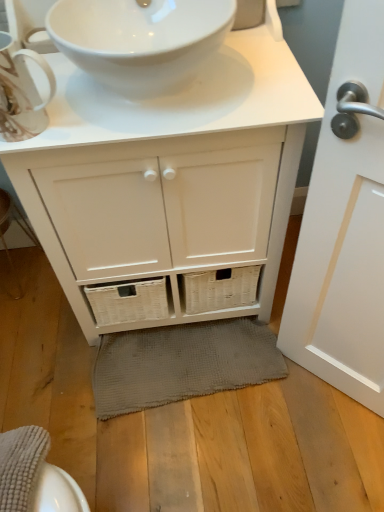
Describe the element at coordinates (169, 185) in the screenshot. I see `white matte cabinet at center` at that location.

What is the approximate width of white glossy door handle at right?

The width of white glossy door handle at right is 3.23 inches.

The image size is (384, 512). I want to click on white glossy sink at upper center, so click(140, 39).

This screenshot has width=384, height=512. I want to click on white matte cabinet at center, so click(x=169, y=185).

In the scene shown: Is white glossy sink at upper center bigger or smaller than matte white teacup at upper left?

Considering their sizes, white glossy sink at upper center takes up more space than matte white teacup at upper left.

Between white glossy sink at upper center and matte white teacup at upper left, which one has larger width?

Wider between the two is white glossy sink at upper center.

How different are the orientations of white glossy sink at upper center and matte white teacup at upper left in degrees?

The angular difference between white glossy sink at upper center and matte white teacup at upper left is 0.000955 degrees.

From the image's perspective, which one is positioned lower, white glossy sink at upper center or matte white teacup at upper left?

matte white teacup at upper left is shown below in the image.

In the scene shown: From a real-world perspective, between white glossy door handle at right and white glossy sink at upper center, who is vertically lower?

white glossy door handle at right.

From the image's perspective, is white glossy door handle at right above white glossy sink at upper center?

No.

Does white glossy door handle at right turn towards white glossy sink at upper center?

No, white glossy door handle at right is not turned towards white glossy sink at upper center.

From the image's perspective, does matte white teacup at upper left appear lower than white glossy door handle at right?

Actually, matte white teacup at upper left appears above white glossy door handle at right in the image.

In terms of width, does matte white teacup at upper left look wider or thinner when compared to white glossy door handle at right?

matte white teacup at upper left is wider than white glossy door handle at right.

Is point (4, 57) positioned behind point (373, 225)?

No, it is not.

Which object is positioned more to the right, matte white teacup at upper left or white glossy door handle at right?

white glossy door handle at right is more to the right.

Is white matte cabinet at center turned away from gray textured bath mat at lower center?

white matte cabinet at center is not turned away from gray textured bath mat at lower center.

From the image's perspective, which one is positioned lower, white matte cabinet at center or gray textured bath mat at lower center?

gray textured bath mat at lower center, from the image's perspective.

From a real-world perspective, is white matte cabinet at center positioned under gray textured bath mat at lower center based on gravity?

No, from a real-world perspective, white matte cabinet at center is not beneath gray textured bath mat at lower center.

Considering the positions of objects gray textured bath mat at lower center and matte white teacup at upper left in the image provided, who is more to the left, gray textured bath mat at lower center or matte white teacup at upper left?

matte white teacup at upper left is more to the left.

Is gray textured bath mat at lower center in front of or behind matte white teacup at upper left in the image?

Clearly, gray textured bath mat at lower center is behind matte white teacup at upper left.

Is gray textured bath mat at lower center placed right next to matte white teacup at upper left?

No, gray textured bath mat at lower center is not beside matte white teacup at upper left.

Is white glossy sink at upper center behind white glossy door handle at right?

Yes, it is.

From a real-world perspective, between white glossy sink at upper center and white glossy door handle at right, who is vertically higher?

white glossy sink at upper center, from a real-world perspective.

Can you confirm if white glossy sink at upper center is wider than white glossy door handle at right?

Indeed, white glossy sink at upper center has a greater width compared to white glossy door handle at right.

Based on their sizes in the image, would you say gray textured bath mat at lower center is bigger or smaller than white matte cabinet at center?

In the image, gray textured bath mat at lower center appears to be smaller than white matte cabinet at center.

From the image's perspective, is gray textured bath mat at lower center located above or below white matte cabinet at center?

Based on their image positions, gray textured bath mat at lower center is located beneath white matte cabinet at center.

Is gray textured bath mat at lower center not near white matte cabinet at center?

They are positioned close to each other.

Is gray textured bath mat at lower center in front of or behind white matte cabinet at center in the image?

gray textured bath mat at lower center is positioned farther from the viewer than white matte cabinet at center.

Locate an element on the screen. sink to the right of matte white teacup at upper left is located at coordinates (140, 39).

Locate an element on the screen. The width and height of the screenshot is (384, 512). sink above the white glossy door handle at right (from a real-world perspective) is located at coordinates (140, 39).

When comparing their distances from gray textured bath mat at lower center, does white glossy door handle at right or white matte cabinet at center seem further?

Among the two, white glossy door handle at right is located further to gray textured bath mat at lower center.

Based on the photo, when comparing their distances from matte white teacup at upper left, does white matte cabinet at center or white glossy sink at upper center seem closer?

Based on the image, white glossy sink at upper center appears to be nearer to matte white teacup at upper left.

Looking at this image, considering their positions, is white glossy sink at upper center positioned closer to white glossy door handle at right than white matte cabinet at center?

white matte cabinet at center is positioned closer to the anchor white glossy door handle at right.

Based on their spatial positions, is white glossy sink at upper center or gray textured bath mat at lower center closer to white glossy door handle at right?

gray textured bath mat at lower center is closer to white glossy door handle at right.

Which object lies nearer to the anchor point white glossy sink at upper center, white matte cabinet at center or matte white teacup at upper left?

matte white teacup at upper left is closer to white glossy sink at upper center.

Considering their positions, is white glossy sink at upper center positioned closer to gray textured bath mat at lower center than white glossy door handle at right?

Answer: white glossy door handle at right lies closer to gray textured bath mat at lower center than the other object.

Based on their spatial positions, is white glossy sink at upper center or gray textured bath mat at lower center further from matte white teacup at upper left?

Among the two, gray textured bath mat at lower center is located further to matte white teacup at upper left.

Estimate the real-world distances between objects in this image. Which object is closer to matte white teacup at upper left, white glossy sink at upper center or white glossy door handle at right?

white glossy sink at upper center is positioned closer to the anchor matte white teacup at upper left.

At what (x,y) coordinates should I click in order to perform the action: click on bathroom cabinet that lies between white glossy sink at upper center and gray textured bath mat at lower center from top to bottom. Please return your answer as a coordinate pair (x, y). This screenshot has height=512, width=384. Looking at the image, I should click on coord(169,185).

You are a GUI agent. You are given a task and a screenshot of the screen. Output one action in this format:
    pyautogui.click(x=<x>, y=<y>)
    Task: Click on the bathroom cabinet between matte white teacup at upper left and gray textured bath mat at lower center from top to bottom
    
    Given the screenshot: What is the action you would take?
    pyautogui.click(x=169, y=185)

Identify the location of bathroom cabinet between white glossy sink at upper center and white glossy door handle at right vertically. Image resolution: width=384 pixels, height=512 pixels. (169, 185).

Where is `bathroom cabinet between white glossy door handle at right and gray textured bath mat at lower center along the z-axis`? Image resolution: width=384 pixels, height=512 pixels. bathroom cabinet between white glossy door handle at right and gray textured bath mat at lower center along the z-axis is located at coordinates (169, 185).